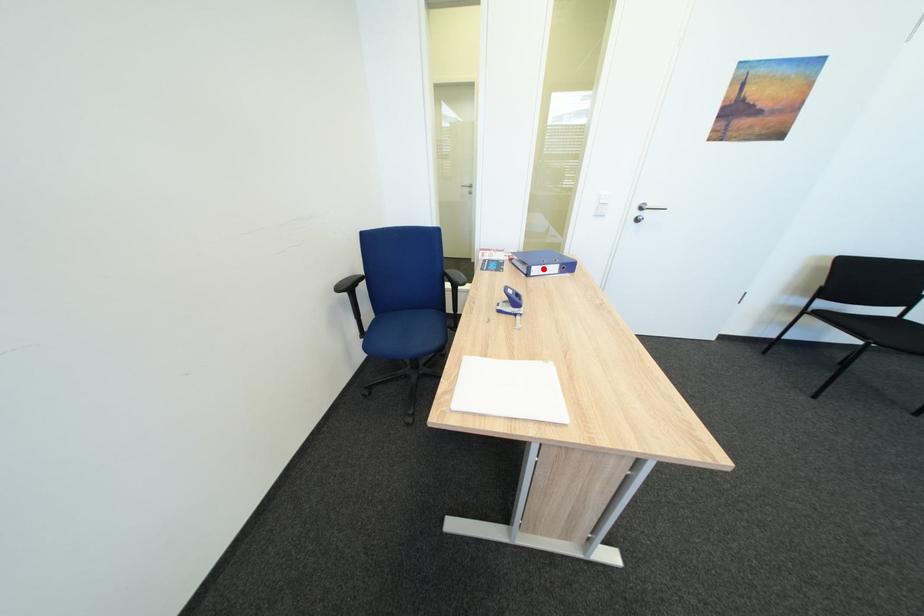
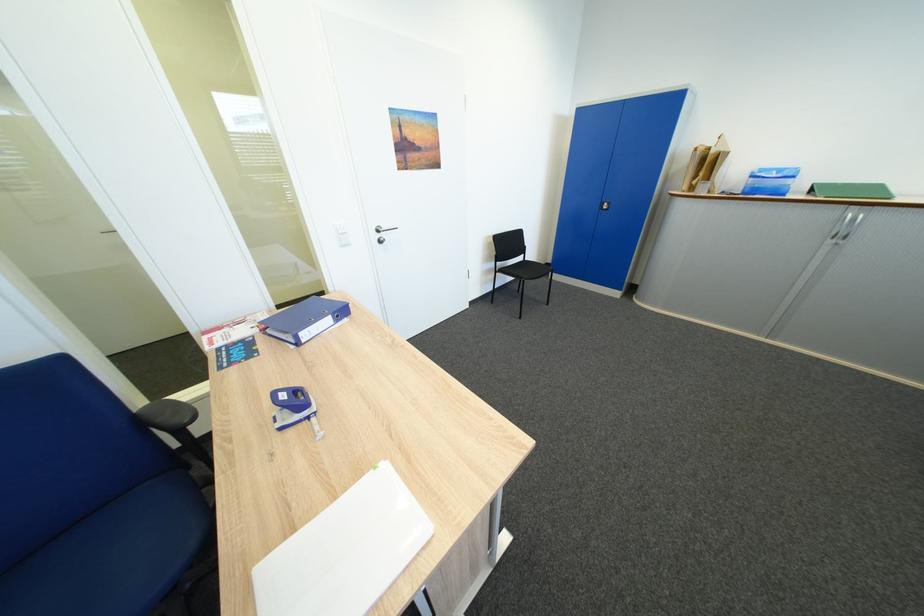
Find the pixel in the second image that matches the highlighted location in the first image.

(310, 334)